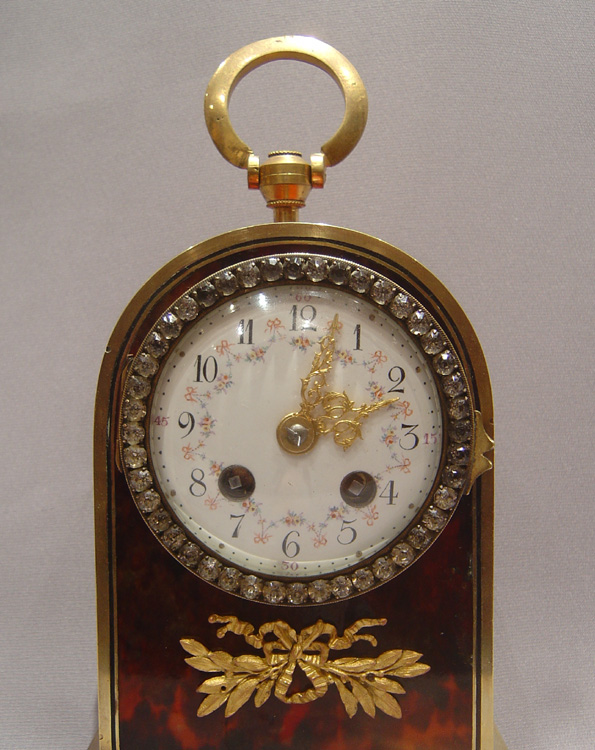
Image resolution: width=595 pixels, height=750 pixels. In order to click on gold border around clock in this screenshot , I will do `click(299, 234)`.